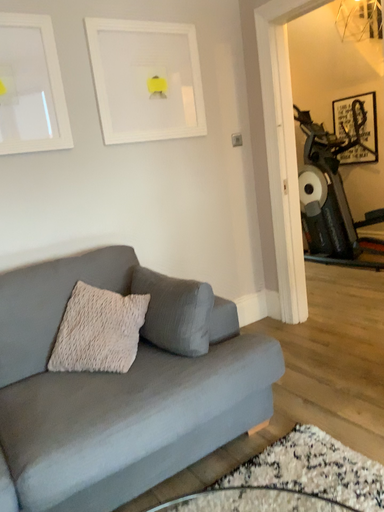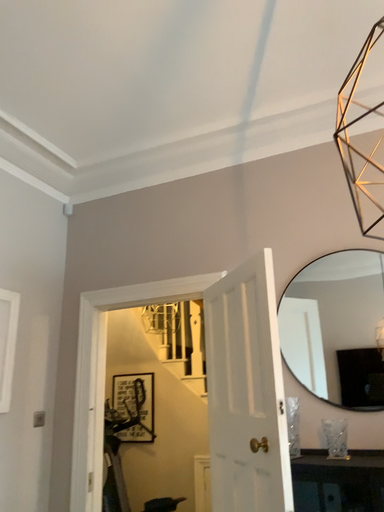
Question: How did the camera likely rotate when shooting the video?

Choices:
 (A) rotated right
 (B) rotated left

Answer: (A)